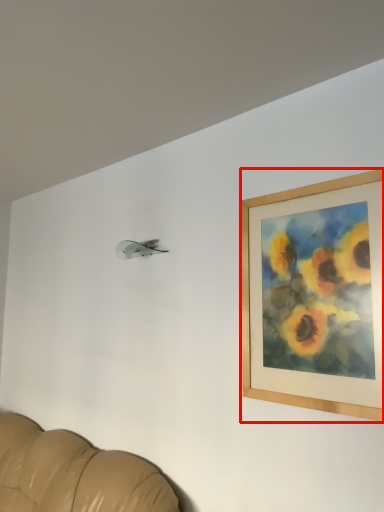
Question: Where is picture frame (annotated by the red box) located in relation to furniture in the image?

Choices:
 (A) right
 (B) left

Answer: (A)